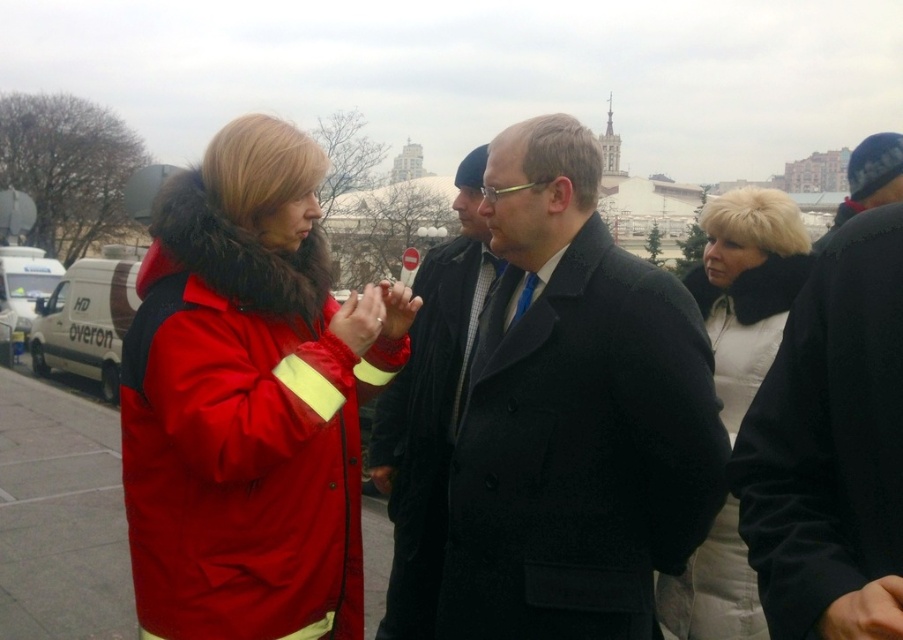
Question: In this image, where is shiny red jacket at center located relative to white fur collar at upper right?

Choices:
 (A) below
 (B) above

Answer: (A)

Question: Is matte black coat at center further to the viewer compared to dark gray wool coat at center?

Choices:
 (A) yes
 (B) no

Answer: (B)

Question: From the image, what is the correct spatial relationship of matte black coat at center in relation to white van at left?

Choices:
 (A) right
 (B) left

Answer: (A)

Question: Which point is farther from the camera taking this photo?

Choices:
 (A) (64, 276)
 (B) (49, 609)
 (C) (576, 461)

Answer: (A)

Question: Considering the real-world distances, which object is closest to the white van at left?

Choices:
 (A) dark gray wool coat at center
 (B) shiny red jacket at center
 (C) matte black coat at center

Answer: (B)

Question: Which object is closer to the camera taking this photo?

Choices:
 (A) red fabric jacket at left
 (B) matte black coat at center
 (C) white fur collar at upper right
 (D) shiny red jacket at center

Answer: (D)